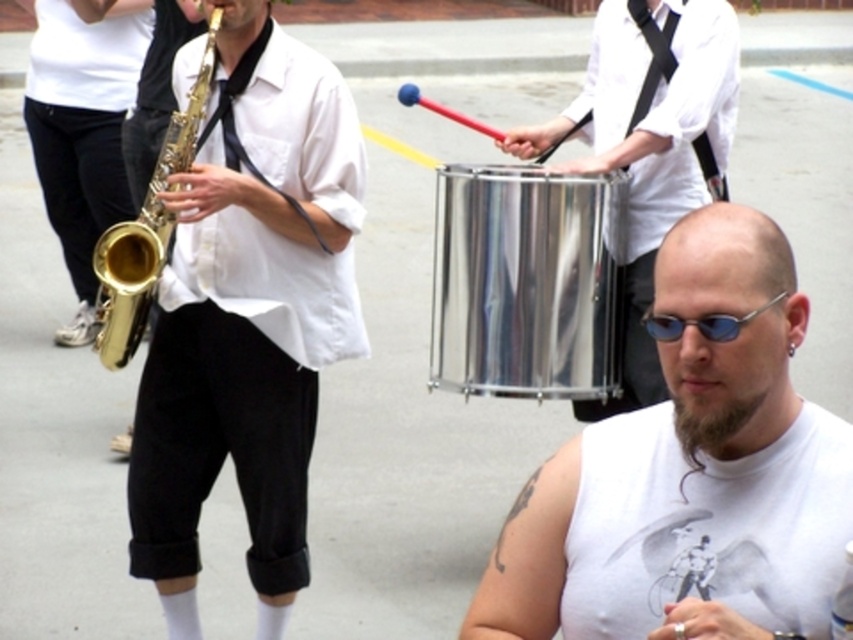
You are a photographer trying to capture the band members in the scene. You notice the shiny metallic drum at center and the gold shiny trumpet at left. Which object should you focus on first if you want to photograph the taller one?

The shiny metallic drum at center is taller than the gold shiny trumpet at left, so you should focus on the shiny metallic drum at center first.

You are a photographer trying to capture a wide shot of the street performance. You notice the gold shiny saxophone at left and the brushed metal drum at center. Which object is wider in the image?

The gold shiny saxophone at left is wider than the brushed metal drum at center.